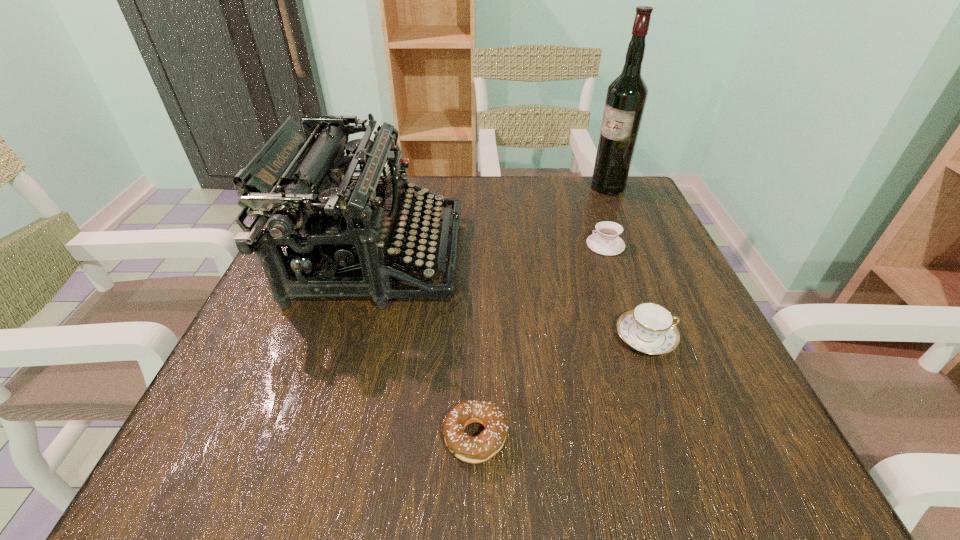
Find the location of a particular element. The height and width of the screenshot is (540, 960). the tallest object is located at coordinates (626, 97).

Identify the location of the farthest object. This screenshot has width=960, height=540. (626, 97).

At what (x,y) coordinates should I click in order to perform the action: click on typewriter. Please return your answer as a coordinate pair (x, y). Image resolution: width=960 pixels, height=540 pixels. Looking at the image, I should click on (300, 180).

You are a GUI agent. You are given a task and a screenshot of the screen. Output one action in this format:
    pyautogui.click(x=<x>, y=<y>)
    Task: Click on the taller teacup
    This screenshot has height=540, width=960.
    Given the screenshot: What is the action you would take?
    pyautogui.click(x=649, y=328)

I want to click on the nearer teacup, so click(x=649, y=328).

Where is `the farther teacup`? This screenshot has width=960, height=540. the farther teacup is located at coordinates (606, 241).

You are a GUI agent. You are given a task and a screenshot of the screen. Output one action in this format:
    pyautogui.click(x=<x>, y=<y>)
    Task: Click on the nearest object
    Image resolution: width=960 pixels, height=540 pixels.
    Given the screenshot: What is the action you would take?
    pyautogui.click(x=480, y=448)

Identify the location of free region located 0.260m on the front and back of the tallest object. pos(488,187).

This screenshot has height=540, width=960. In order to click on free space located 0.250m on the front and back of the tallest object in this screenshot , I will do `click(492, 187)`.

Locate an element on the screen. free region located on the front and back of the tallest object is located at coordinates (484, 187).